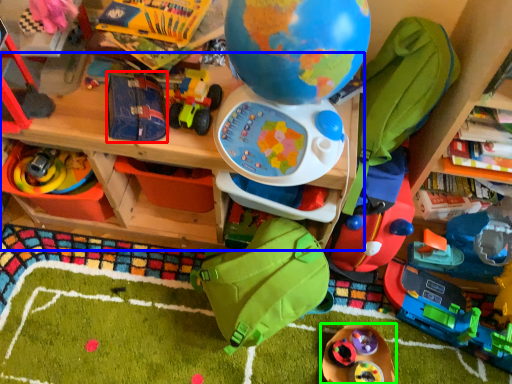
Question: Considering the real-world distances, which object is closest to toy (highlighted by a red box)? table (highlighted by a blue box) or toy (highlighted by a green box).

Choices:
 (A) table
 (B) toy

Answer: (A)